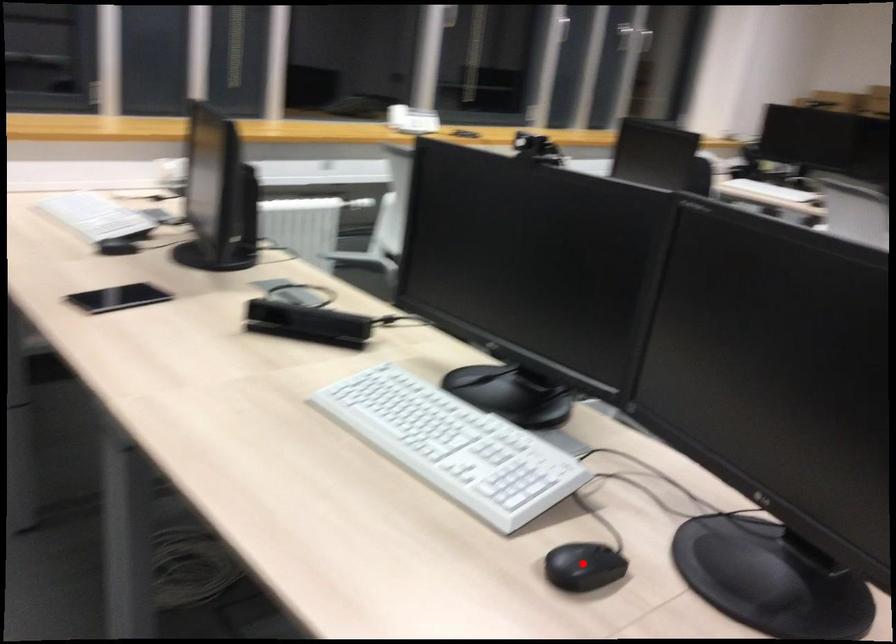
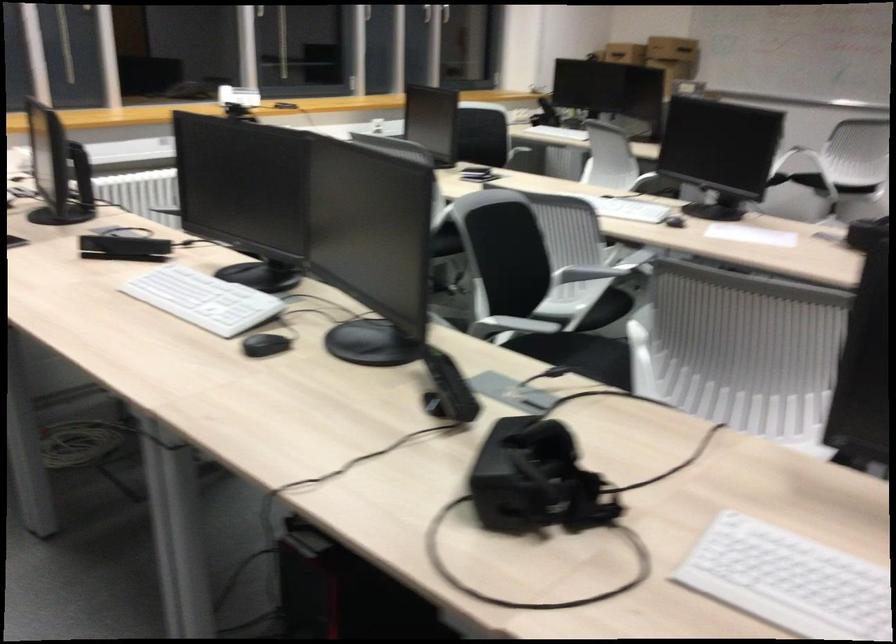
Question: I am providing you with two images of the same scene from different viewpoints. Given a red point in image1, look at the same physical point in image2. Is it:

Choices:
 (A) Closer to the viewpoint
 (B) Farther from the viewpoint

Answer: (B)